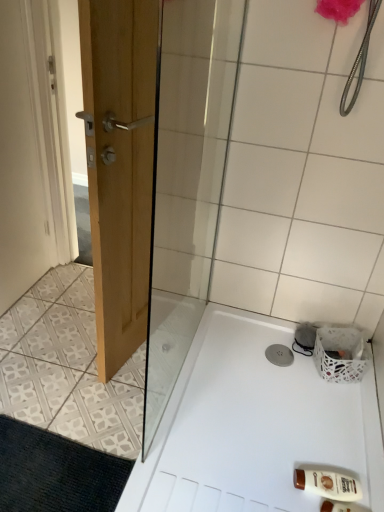
This screenshot has width=384, height=512. What do you see at coordinates (328, 484) in the screenshot? I see `brown plastic bottle at lower right` at bounding box center [328, 484].

Describe the element at coordinates (340, 354) in the screenshot. The image size is (384, 512). I see `white woven basket at lower right` at that location.

What is the approximate width of white plastic bath at lower right?

The width of white plastic bath at lower right is 31.16 inches.

At what (x,y) coordinates should I click in order to perform the action: click on black textured bath mat at lower left. Please return your answer as a coordinate pair (x, y). The width and height of the screenshot is (384, 512). Looking at the image, I should click on (56, 472).

Identify the location of brown plastic bottle at lower right. (328, 484).

Is black textured bath mat at lower left facing away from white woven basket at lower right?

No, white woven basket at lower right is not at the back of black textured bath mat at lower left.

Based on the photo, is black textured bath mat at lower left spatially inside white woven basket at lower right, or outside of it?

black textured bath mat at lower left is located beyond the bounds of white woven basket at lower right.

Considering the sizes of objects black textured bath mat at lower left and white woven basket at lower right in the image provided, who is bigger, black textured bath mat at lower left or white woven basket at lower right?

With larger size is white woven basket at lower right.

Considering the sizes of objects black textured bath mat at lower left and white woven basket at lower right in the image provided, who is taller, black textured bath mat at lower left or white woven basket at lower right?

Standing taller between the two is white woven basket at lower right.

Does white woven basket at lower right appear on the right side of white plastic bath at lower right?

Yes, white woven basket at lower right is to the right of white plastic bath at lower right.

Are white woven basket at lower right and white plastic bath at lower right located far from each other?

Actually, white woven basket at lower right and white plastic bath at lower right are a little close together.

Which of these two, white woven basket at lower right or white plastic bath at lower right, is thinner?

With smaller width is white woven basket at lower right.

Which is behind, point (327, 376) or point (326, 428)?

The point (327, 376) is more distant.

From a real-world perspective, is white woven basket at lower right positioned under black textured bath mat at lower left based on gravity?

No, from a real-world perspective, white woven basket at lower right is not under black textured bath mat at lower left.

From the image's perspective, is white woven basket at lower right on top of black textured bath mat at lower left?

Yes, from the image's perspective, white woven basket at lower right is on top of black textured bath mat at lower left.

Is white woven basket at lower right located outside black textured bath mat at lower left?

That's correct, white woven basket at lower right is outside of black textured bath mat at lower left.

Considering the sizes of objects black textured bath mat at lower left and white plastic bath at lower right in the image provided, who is taller, black textured bath mat at lower left or white plastic bath at lower right?

white plastic bath at lower right is taller.

Is black textured bath mat at lower left oriented towards white plastic bath at lower right?

No, black textured bath mat at lower left is not aimed at white plastic bath at lower right.

Considering the sizes of objects black textured bath mat at lower left and white plastic bath at lower right in the image provided, who is smaller, black textured bath mat at lower left or white plastic bath at lower right?

Smaller between the two is black textured bath mat at lower left.

Are white woven basket at lower right and brown plastic bottle at lower right far apart?

No, white woven basket at lower right is not far away from brown plastic bottle at lower right.

Can you confirm if white woven basket at lower right is bigger than brown plastic bottle at lower right?

Indeed, white woven basket at lower right has a larger size compared to brown plastic bottle at lower right.

Where is `toiletry to the left of white woven basket at lower right`? The image size is (384, 512). toiletry to the left of white woven basket at lower right is located at coordinates (328, 484).

Can you confirm if white woven basket at lower right is thinner than brown plastic bottle at lower right?

In fact, white woven basket at lower right might be wider than brown plastic bottle at lower right.

Is white plastic bath at lower right oriented away from white woven basket at lower right?

white plastic bath at lower right does not have its back to white woven basket at lower right.

Locate an element on the screen. The height and width of the screenshot is (512, 384). basket above the white plastic bath at lower right (from a real-world perspective) is located at coordinates (340, 354).

In terms of height, does white plastic bath at lower right look taller or shorter compared to white woven basket at lower right?

In the image, white plastic bath at lower right appears to be shorter than white woven basket at lower right.

Is white plastic bath at lower right not near white woven basket at lower right?

No.

Considering their positions, is brown plastic bottle at lower right located in front of or behind black textured bath mat at lower left?

Clearly, brown plastic bottle at lower right is behind black textured bath mat at lower left.

Looking at the image, does brown plastic bottle at lower right seem bigger or smaller compared to black textured bath mat at lower left?

Considering their sizes, brown plastic bottle at lower right takes up less space than black textured bath mat at lower left.

Considering the sizes of objects brown plastic bottle at lower right and black textured bath mat at lower left in the image provided, who is wider, brown plastic bottle at lower right or black textured bath mat at lower left?

Wider between the two is black textured bath mat at lower left.

At what (x,y) coordinates should I click in order to perform the action: click on basket that appears on the right of black textured bath mat at lower left. Please return your answer as a coordinate pair (x, y). This screenshot has height=512, width=384. Looking at the image, I should click on (340, 354).

Where is `bath below the white woven basket at lower right (from the image's perspective)`? bath below the white woven basket at lower right (from the image's perspective) is located at coordinates (254, 426).

From the image, which object appears to be nearer to brown plastic bottle at lower right, black textured bath mat at lower left or white woven basket at lower right?

white woven basket at lower right lies closer to brown plastic bottle at lower right than the other object.

Looking at the image, which one is located closer to white woven basket at lower right, brown plastic bottle at lower right or white plastic bath at lower right?

The object closer to white woven basket at lower right is white plastic bath at lower right.

From the image, which object appears to be farther from white woven basket at lower right, white plastic bath at lower right or brown plastic bottle at lower right?

Among the two, brown plastic bottle at lower right is located further to white woven basket at lower right.

From the image, which object appears to be farther from white woven basket at lower right, white plastic bath at lower right or black textured bath mat at lower left?

black textured bath mat at lower left lies further to white woven basket at lower right than the other object.

Which object lies further to the anchor point black textured bath mat at lower left, brown plastic bottle at lower right or white woven basket at lower right?

white woven basket at lower right lies further to black textured bath mat at lower left than the other object.

Considering their positions, is white woven basket at lower right positioned further to brown plastic bottle at lower right than black textured bath mat at lower left?

The object further to brown plastic bottle at lower right is black textured bath mat at lower left.

Consider the image. Estimate the real-world distances between objects in this image. Which object is closer to white woven basket at lower right, black textured bath mat at lower left or white plastic bath at lower right?

white plastic bath at lower right.

Considering their positions, is brown plastic bottle at lower right positioned closer to white plastic bath at lower right than white woven basket at lower right?

The object closer to white plastic bath at lower right is brown plastic bottle at lower right.

Where is `toiletry between white plastic bath at lower right and white woven basket at lower right along the z-axis`? The width and height of the screenshot is (384, 512). toiletry between white plastic bath at lower right and white woven basket at lower right along the z-axis is located at coordinates coord(328,484).

Find the location of a particular element. bath located between black textured bath mat at lower left and white woven basket at lower right in the left-right direction is located at coordinates click(254, 426).

You are a GUI agent. You are given a task and a screenshot of the screen. Output one action in this format:
    pyautogui.click(x=<x>, y=<y>)
    Task: Click on the bath situated between black textured bath mat at lower left and brown plastic bottle at lower right from left to right
    
    Given the screenshot: What is the action you would take?
    pyautogui.click(x=254, y=426)

Locate an element on the screen. Image resolution: width=384 pixels, height=512 pixels. toiletry between black textured bath mat at lower left and white woven basket at lower right from left to right is located at coordinates (328, 484).